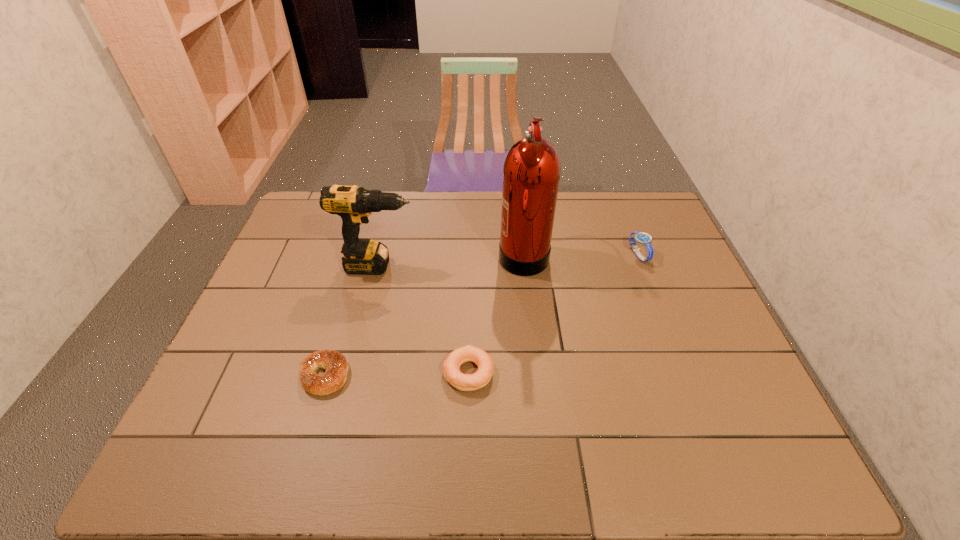
You are a GUI agent. You are given a task and a screenshot of the screen. Output one action in this format:
    pyautogui.click(x=<x>, y=<y>)
    Task: Click on the vacant area between the second object from right to left and the third tallest object
    This screenshot has width=960, height=540.
    Given the screenshot: What is the action you would take?
    pyautogui.click(x=581, y=254)

Locate an element on the screen. empty location between the watch and the tallest object is located at coordinates point(581,254).

At what (x,y) coordinates should I click in order to perform the action: click on the fourth closest object relative to the drill. Please return your answer as a coordinate pair (x, y). The image size is (960, 540). Looking at the image, I should click on (643, 238).

Locate an element on the screen. The image size is (960, 540). object that stands as the fourth closest to the tallest object is located at coordinates (336, 366).

Image resolution: width=960 pixels, height=540 pixels. Find the location of `vacant region that satisfies the following two spatial constraints: 1. on the back side of the third object from right to left; 2. at the tip of the drill`. vacant region that satisfies the following two spatial constraints: 1. on the back side of the third object from right to left; 2. at the tip of the drill is located at coordinates (470, 266).

You are a GUI agent. You are given a task and a screenshot of the screen. Output one action in this format:
    pyautogui.click(x=<x>, y=<y>)
    Task: Click on the vacant space that satisfies the following two spatial constraints: 1. on the back side of the third tallest object; 2. on the left side of the left bagel
    
    Given the screenshot: What is the action you would take?
    pyautogui.click(x=360, y=255)

Where is `vacant space that satisfies the following two spatial constraints: 1. at the tip of the second tallest object; 2. on the front side of the left bagel`? The width and height of the screenshot is (960, 540). vacant space that satisfies the following two spatial constraints: 1. at the tip of the second tallest object; 2. on the front side of the left bagel is located at coordinates (352, 375).

Find the location of a particular element. vacant region that satisfies the following two spatial constraints: 1. on the front-facing side of the second object from right to left; 2. on the right side of the rightmost object is located at coordinates click(x=523, y=255).